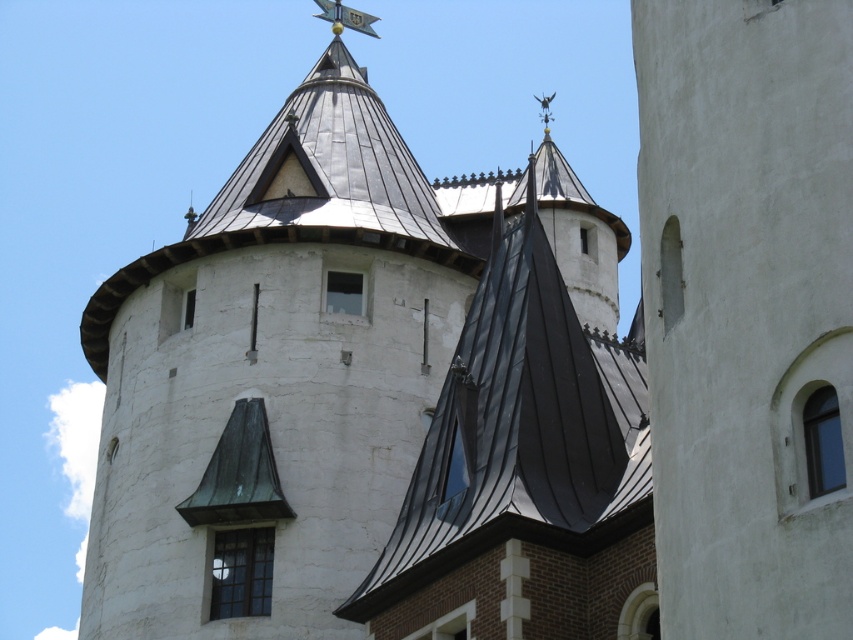
You are standing in front of the building and want to touch the white smooth wall at right and the black metal roof at center. Which one can you reach without climbing?

The white smooth wall at right is in front of the black metal roof at center, so you can reach the white smooth wall at right without climbing, but the black metal roof at center is higher and requires climbing to reach.

You are an architect planning to install a new decorative light between the white stone tower at center and the white smooth wall at right. Based on their positions, which object should the light be placed closer to?

The white stone tower at center is positioned under the white smooth wall at right, so the light should be placed closer to the white stone tower at center since it is directly below the wall.